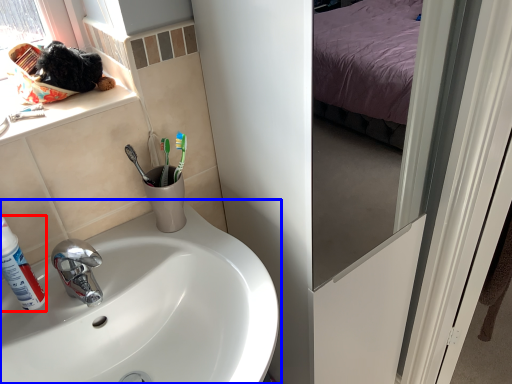
Question: Which point is closer to the camera, shaving cream (highlighted by a red box) or sink (highlighted by a blue box)?

Choices:
 (A) shaving cream
 (B) sink

Answer: (B)